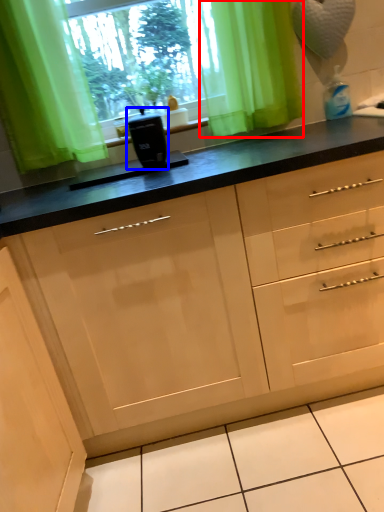
Question: Among these objects, which one is nearest to the camera, curtain (highlighted by a red box) or appliance (highlighted by a blue box)?

Choices:
 (A) curtain
 (B) appliance

Answer: (B)